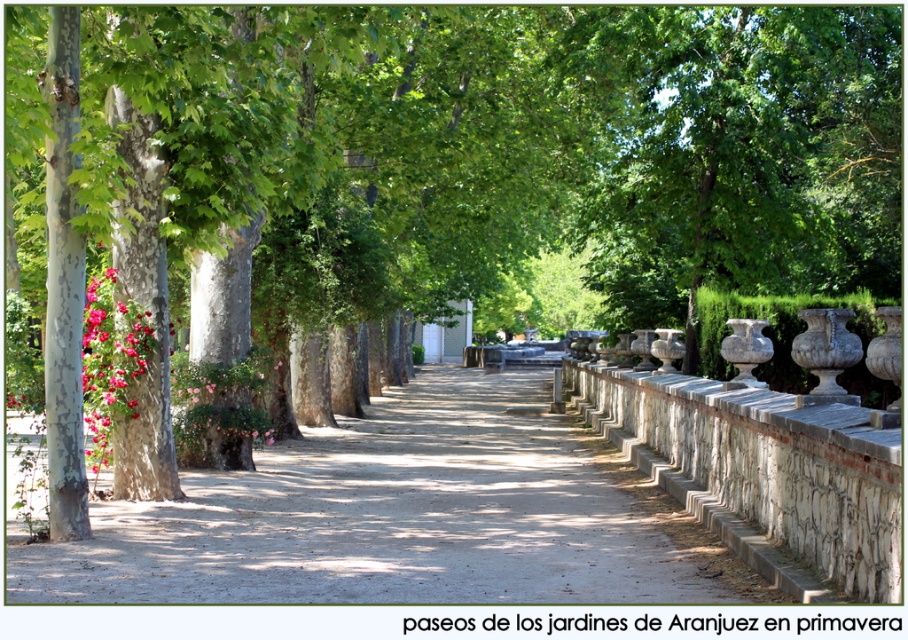
Does dirt path at center appear on the right side of pink matte flowers at left?

Indeed, dirt path at center is positioned on the right side of pink matte flowers at left.

Can you confirm if dirt path at center is shorter than pink matte flowers at left?

Yes.

This screenshot has height=640, width=908. What do you see at coordinates (390, 516) in the screenshot?
I see `dirt path at center` at bounding box center [390, 516].

Identify the location of dirt path at center. Image resolution: width=908 pixels, height=640 pixels. (390, 516).